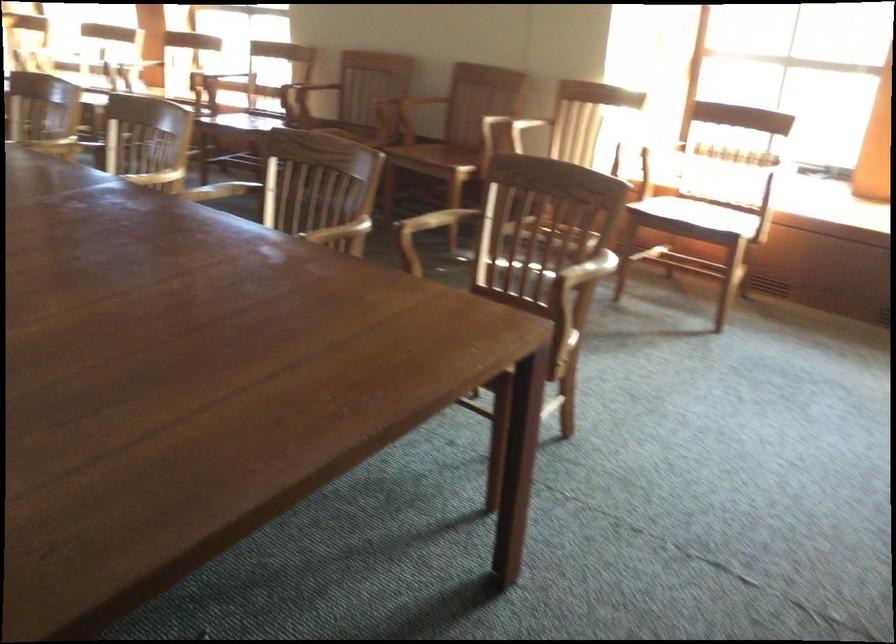
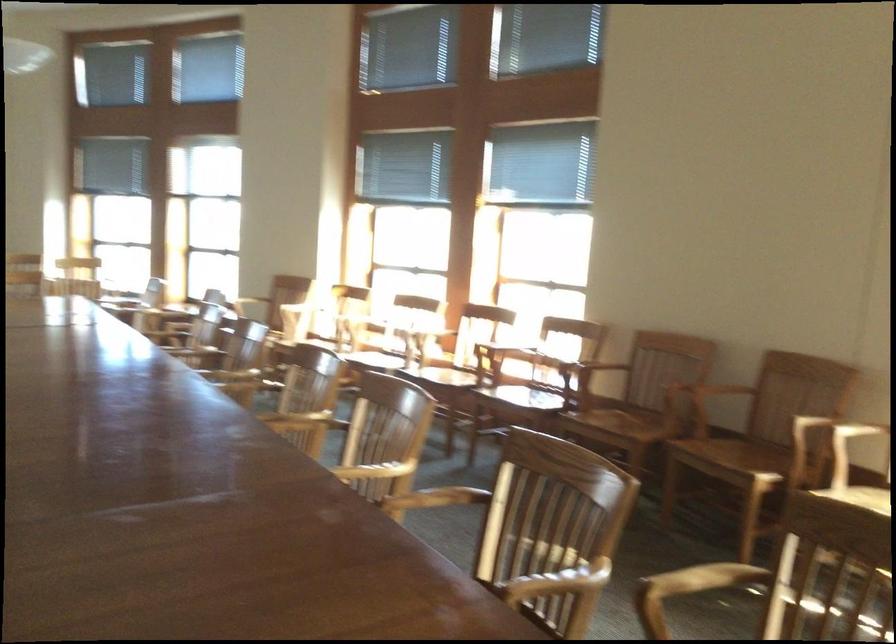
Question: The images are taken continuously from a first-person perspective. In which direction are you moving?

Choices:
 (A) Left
 (B) Right
 (C) Forward
 (D) Backward

Answer: (C)